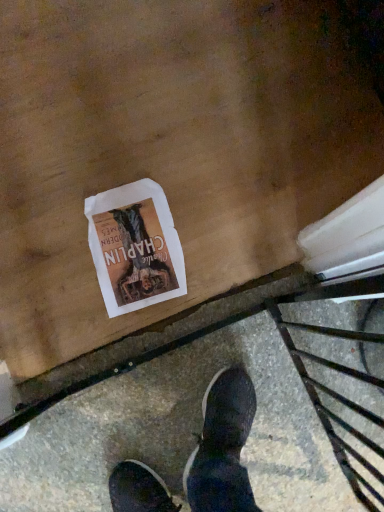
At what (x,y) coordinates should I click in order to perform the action: click on vacant area situated to the left side of white paper flyer at center. Please return your answer as a coordinate pair (x, y). Looking at the image, I should click on (45, 256).